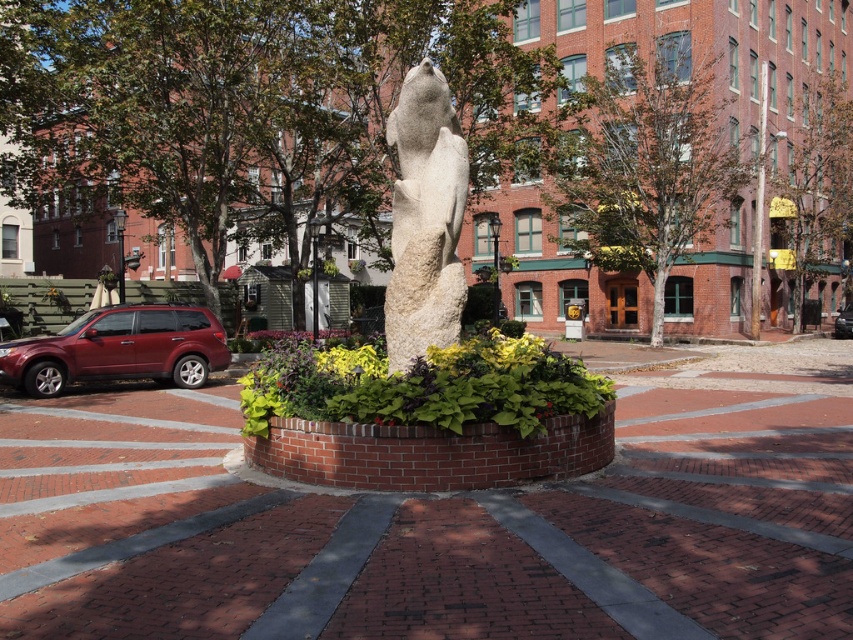
Question: Estimate the real-world distances between objects in this image. Which object is closer to the white stone statue at center?

Choices:
 (A) matte red suv at left
 (B) metallic silver sedan at center

Answer: (A)

Question: Among these points, which one is farthest from the camera?

Choices:
 (A) (434, 232)
 (B) (838, 333)
 (C) (199, 376)

Answer: (B)

Question: Can you confirm if matte red suv at left is smaller than metallic silver sedan at center?

Choices:
 (A) yes
 (B) no

Answer: (A)

Question: Is white stone statue at center to the right of metallic silver sedan at center from the viewer's perspective?

Choices:
 (A) no
 (B) yes

Answer: (A)

Question: Which object is positioned closest to the metallic silver sedan at center?

Choices:
 (A) white stone statue at center
 (B) matte red suv at left

Answer: (A)

Question: Is white stone statue at center smaller than metallic silver sedan at center?

Choices:
 (A) yes
 (B) no

Answer: (A)